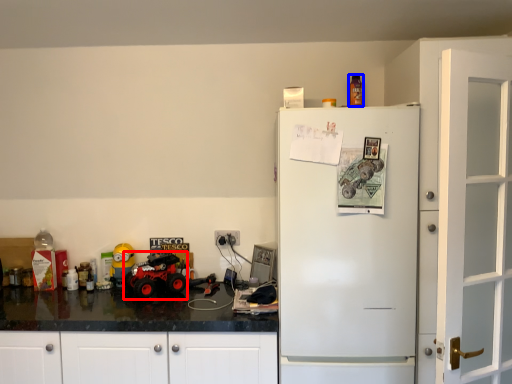
Question: Which object appears closest to the camera in this image, monster truck (highlighted by a red box) or toy (highlighted by a blue box)?

Choices:
 (A) monster truck
 (B) toy

Answer: (A)